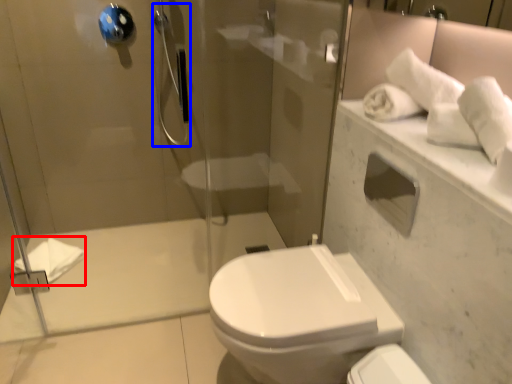
Question: Which object is further to the camera taking this photo, bath towel (highlighted by a red box) or shower (highlighted by a blue box)?

Choices:
 (A) bath towel
 (B) shower

Answer: (A)